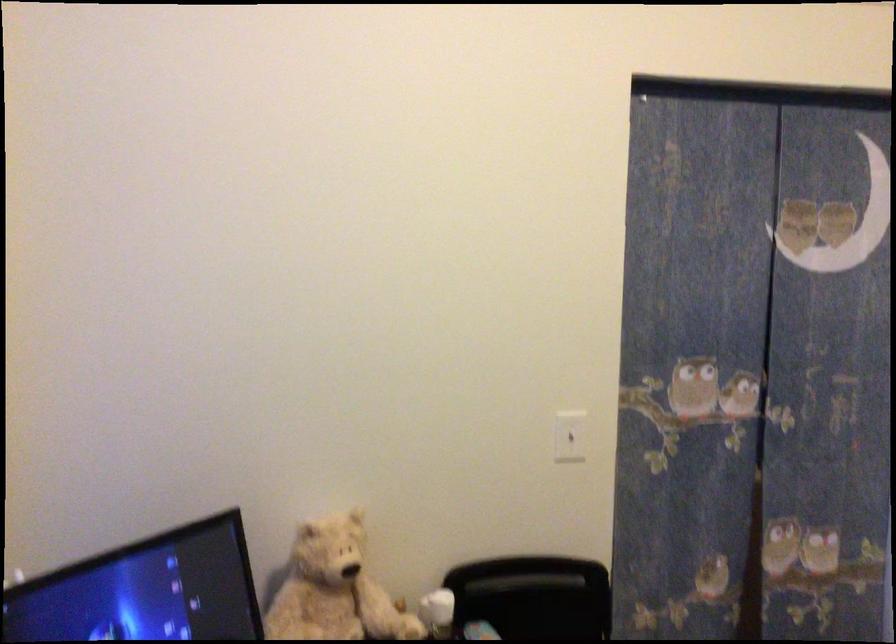
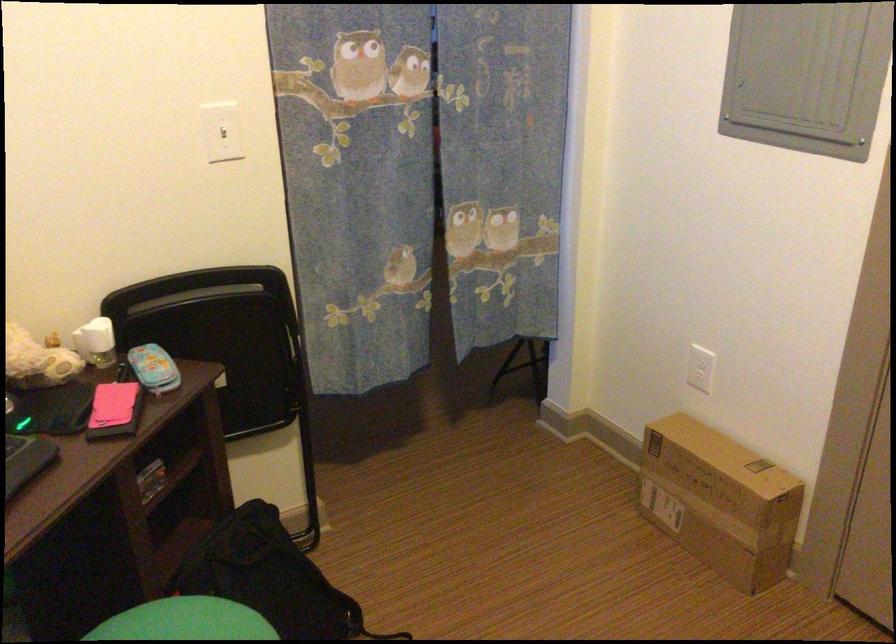
Find the pixel in the second image that matches the point at 573,437 in the first image.

(222, 131)